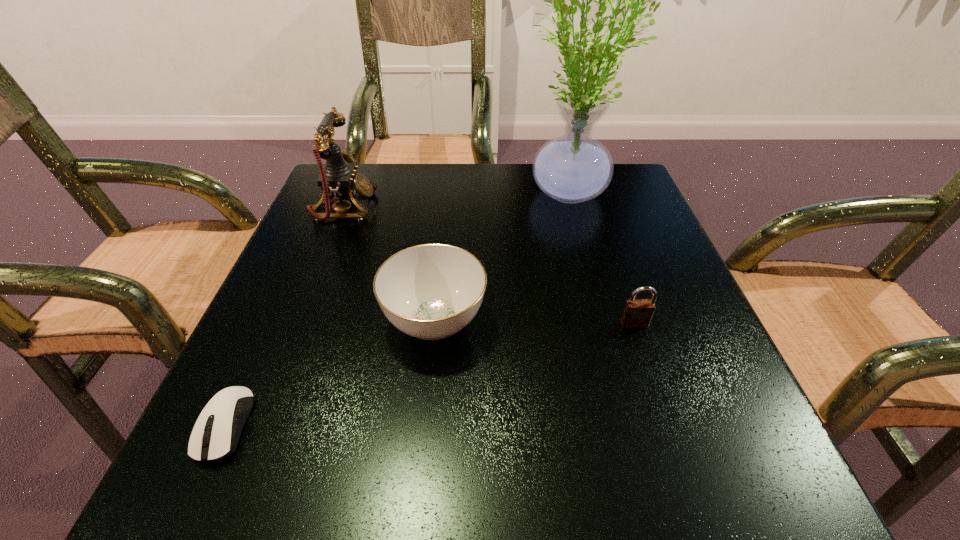
Locate an element on the screen. This screenshot has height=540, width=960. object positioned at the far right corner is located at coordinates (573, 168).

In the image, there is a desktop. At what (x,y) coordinates should I click in order to perform the action: click on free region at the far edge. Please return your answer as a coordinate pair (x, y). Looking at the image, I should click on (471, 204).

Locate an element on the screen. Image resolution: width=960 pixels, height=540 pixels. vacant space at the near edge of the desktop is located at coordinates (541, 473).

The width and height of the screenshot is (960, 540). Find the location of `vacant area at the left edge of the desktop`. vacant area at the left edge of the desktop is located at coordinates (280, 349).

Find the location of a particular element. The image size is (960, 540). free location at the right edge of the desktop is located at coordinates (643, 261).

Find the location of a particular element. vacant space at the far left corner is located at coordinates (394, 172).

You are a GUI agent. You are given a task and a screenshot of the screen. Output one action in this format:
    pyautogui.click(x=<x>, y=<y>)
    Task: Click on the free space at the near right corner of the desktop
    Image resolution: width=960 pixels, height=540 pixels.
    Given the screenshot: What is the action you would take?
    pyautogui.click(x=657, y=495)

I want to click on free spot between the flower arrangement and the telephone, so click(x=455, y=201).

Find the location of a particular element. vacant space in between the shortest object and the padlock is located at coordinates (430, 375).

This screenshot has height=540, width=960. Identify the location of free space between the flower arrangement and the telephone. (455, 201).